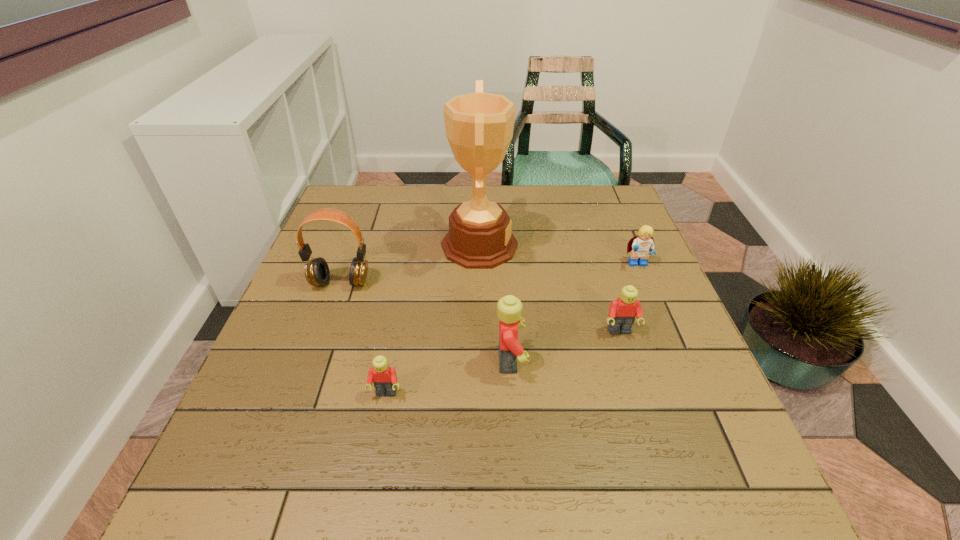
You are a GUI agent. You are given a task and a screenshot of the screen. Output one action in this format:
    pyautogui.click(x=<x>, y=<y>)
    Task: Click on the blank space located 0.080m on the face of the second object from left to right
    
    Given the screenshot: What is the action you would take?
    pyautogui.click(x=377, y=441)

Locate an element on the screen. This screenshot has width=960, height=540. free space located 0.070m on the face of the tallest Lego is located at coordinates (560, 361).

Find the location of a particular element. This screenshot has width=960, height=540. vacant region located 0.070m on the face of the second farthest Lego is located at coordinates (630, 366).

Where is `vacant space located on the ear cups of the leftmost object`? The image size is (960, 540). vacant space located on the ear cups of the leftmost object is located at coordinates click(305, 382).

Where is `free space located on the front-facing side of the tallest object`? The width and height of the screenshot is (960, 540). free space located on the front-facing side of the tallest object is located at coordinates (616, 246).

Locate an element on the screen. Image resolution: width=960 pixels, height=540 pixels. free space located on the front-facing side of the rightmost Lego is located at coordinates pyautogui.click(x=696, y=402).

At what (x,y) coordinates should I click in order to perform the action: click on object at the far edge. Please return your answer as a coordinate pair (x, y). Looking at the image, I should click on (479, 126).

Find the location of a particular element. Image resolution: width=960 pixels, height=540 pixels. object that is at the left edge is located at coordinates (317, 273).

This screenshot has width=960, height=540. In the image, there is a desktop. What are the coordinates of `vacant space at the far edge` in the screenshot? It's located at (397, 200).

In the image, there is a desktop. Identify the location of blank space at the left edge. (343, 288).